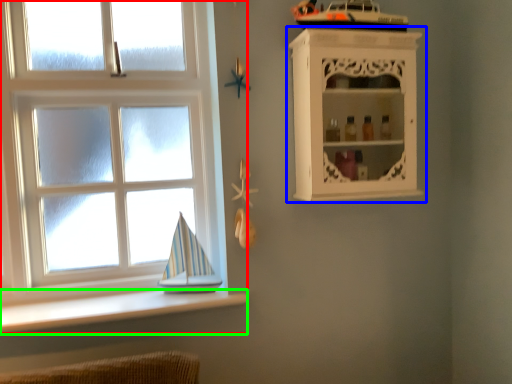
Question: Estimate the real-world distances between objects in this image. Which object is closer to window (highlighted by a red box), shelf (highlighted by a blue box) or ledge (highlighted by a green box)?

Choices:
 (A) shelf
 (B) ledge

Answer: (B)